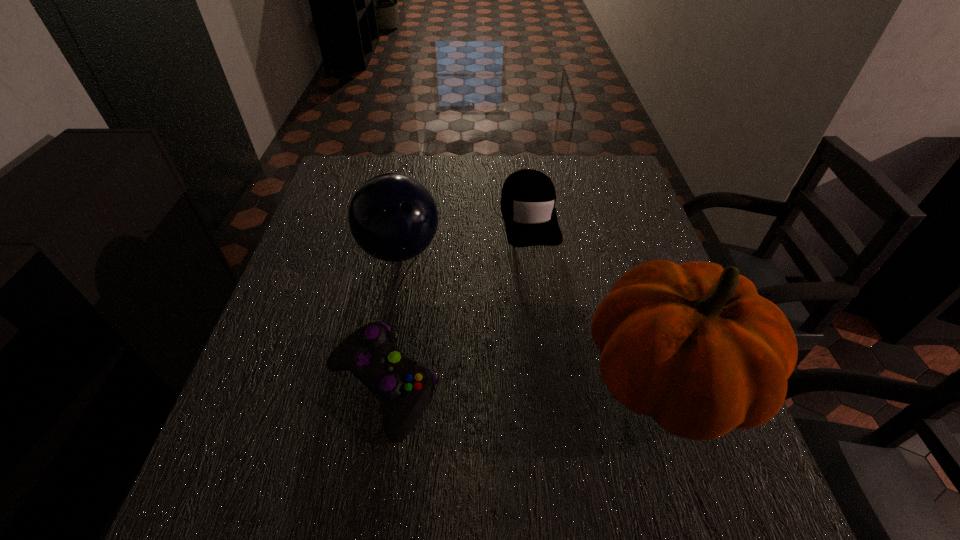
Locate an element on the screen. vacant space on the desktop that is between the control and the tallest object and is positioned on the surface of the bowling ball near the finger holes is located at coordinates (543, 383).

Locate an element on the screen. The width and height of the screenshot is (960, 540). free spot on the desktop that is between the control and the pumpkin and is positioned on the front-facing side of the second shortest object is located at coordinates (569, 382).